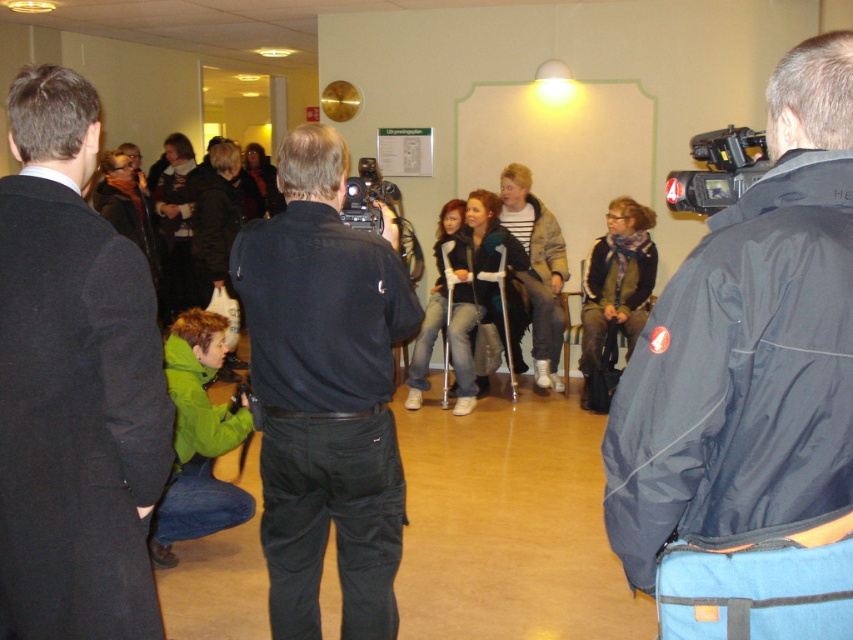
You are a photographer who needs to position yourself to capture a photo of both the dark blue jacket at center and the black plastic video camera at upper right. Based on their positions, where should you stand relative to these objects to ensure both are in your camera frame?

You should position yourself below both the dark blue jacket at center and the black plastic video camera at upper right since the dark blue jacket at center is located below the black plastic video camera at upper right, allowing both to be captured in the frame when positioned appropriately.

You are standing in the room and need to place a small table exactly at the center of the room. The dark blue jacket at center is currently at point 0.548, 0.879. Is the jacket positioned to the left or right of where the table should be placed?

The dark blue jacket at center is located at point (749, 349). Since the table should be placed at the exact center of the room, which would be at coordinates (426, 320), the jacket is positioned to the right and above the table location.

You are a photographer at the event and need to capture a photo of the dark blue jacket at center and the black plastic video camera at center. Which object should you focus on first if you want to include both in your frame without moving the camera?

The dark blue jacket at center is positioned on the right side of the black plastic video camera at center, so you should focus on the black plastic video camera at center first to ensure both are within the frame.